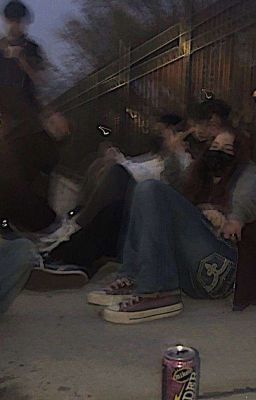
Where is `floor`? The width and height of the screenshot is (256, 400). floor is located at coordinates (52, 313), (121, 368), (235, 339).